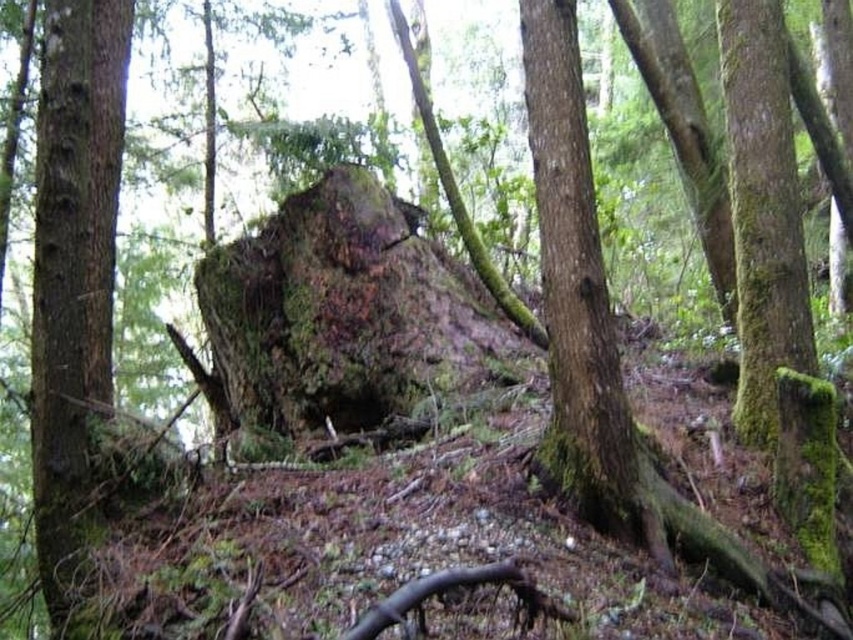
Is green mossy tree trunk at center wider than green mossy tree trunk at right?

Correct, the width of green mossy tree trunk at center exceeds that of green mossy tree trunk at right.

From the picture: Which is above, green mossy tree trunk at center or green mossy tree trunk at right?

green mossy tree trunk at right is higher up.

Identify the location of green mossy tree trunk at center. The height and width of the screenshot is (640, 853). (73, 268).

Is green mossy rock at center thinner than green mossy tree trunk at right?

No, green mossy rock at center is not thinner than green mossy tree trunk at right.

Is point (219, 250) closer to camera compared to point (784, 176)?

No, it is not.

In order to click on green mossy rock at center in this screenshot , I will do `click(344, 314)`.

From the picture: Who is higher up, green mossy rock at center or green mossy tree trunk at center?

Positioned higher is green mossy tree trunk at center.

Does green mossy rock at center appear on the right side of green mossy tree trunk at center?

Indeed, green mossy rock at center is positioned on the right side of green mossy tree trunk at center.

The image size is (853, 640). What do you see at coordinates (344, 314) in the screenshot? I see `green mossy rock at center` at bounding box center [344, 314].

Locate an element on the screen. The image size is (853, 640). green mossy rock at center is located at coordinates (344, 314).